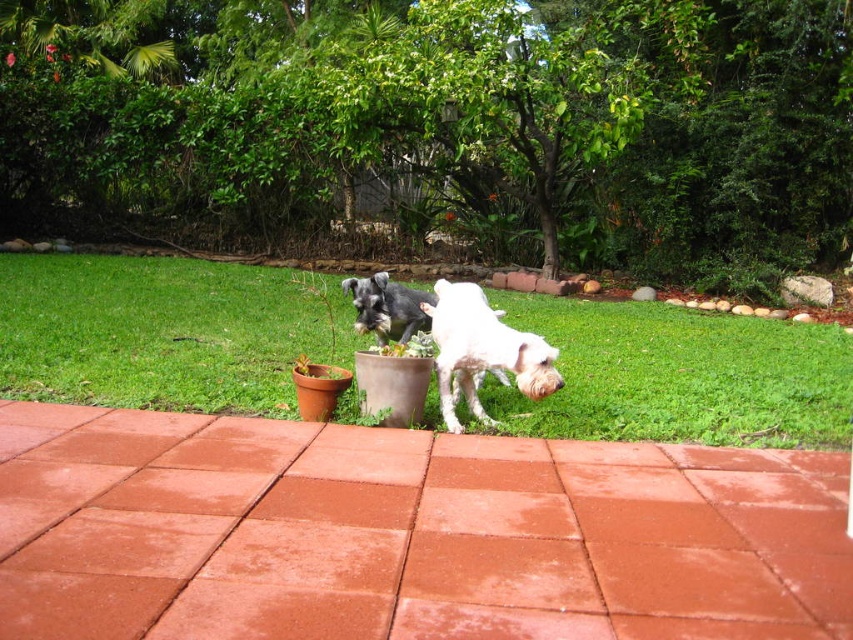
Does green grass at center have a lesser width compared to white fur dog at center?

No.

Is point (515, 301) positioned behind point (498, 346)?

That is True.

Find the location of a particular element. green grass at center is located at coordinates (161, 332).

Find the location of a particular element. green grass at center is located at coordinates (161, 332).

Between white fur dog at center and shiny black dog at center, which one appears on the right side from the viewer's perspective?

white fur dog at center

Can you confirm if white fur dog at center is bigger than shiny black dog at center?

Correct, white fur dog at center is larger in size than shiny black dog at center.

The image size is (853, 640). Describe the element at coordinates (482, 349) in the screenshot. I see `white fur dog at center` at that location.

What are the coordinates of `white fur dog at center` in the screenshot? It's located at click(482, 349).

From the picture: Who is more forward, (601, 356) or (386, 284)?

Positioned in front is point (386, 284).

This screenshot has width=853, height=640. Describe the element at coordinates (161, 332) in the screenshot. I see `green grass at center` at that location.

Find the location of a particular element. Image resolution: width=853 pixels, height=640 pixels. green grass at center is located at coordinates (161, 332).